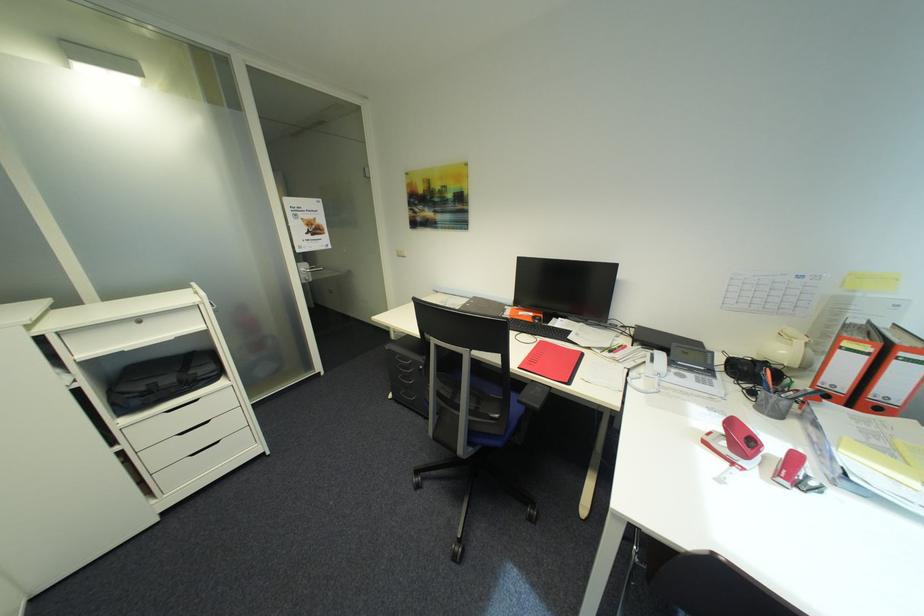
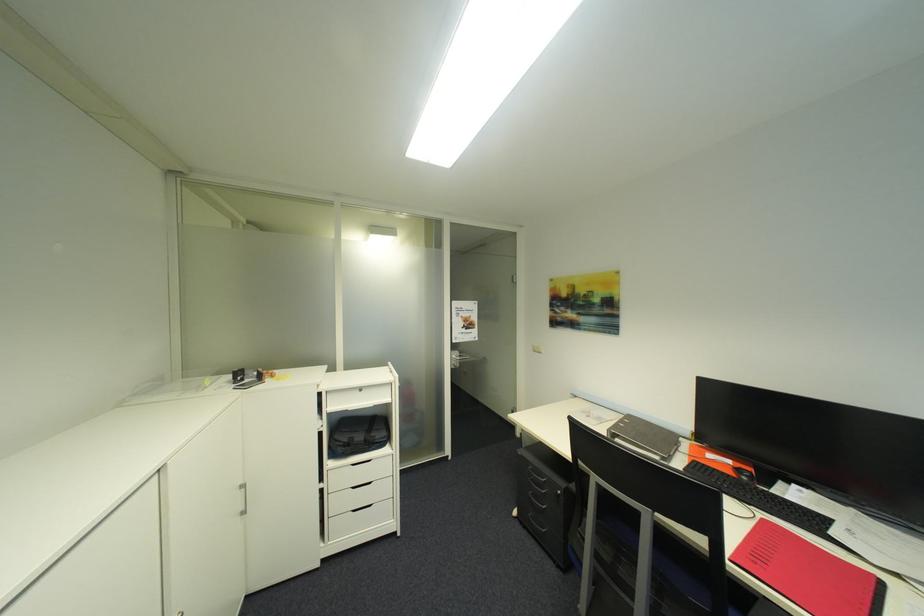
Where in the second image is the point corresponding to (542,345) from the first image?

(760, 524)